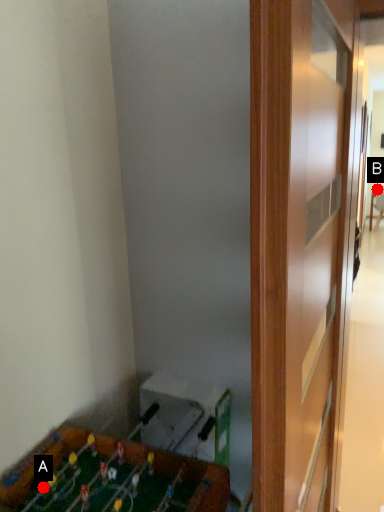
Question: Two points are circled on the image, labeled by A and B beside each circle. Among these points, which one is farthest from the camera?

Choices:
 (A) A is further
 (B) B is further

Answer: (B)